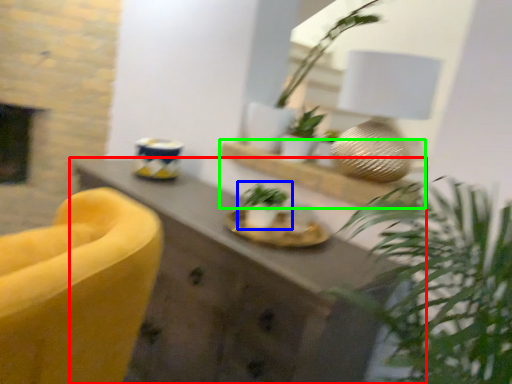
Question: Estimate the real-world distances between objects in this image. Which object is closer to desk (highlighted by a red box), houseplant (highlighted by a blue box) or shelf (highlighted by a green box)?

Choices:
 (A) houseplant
 (B) shelf

Answer: (A)